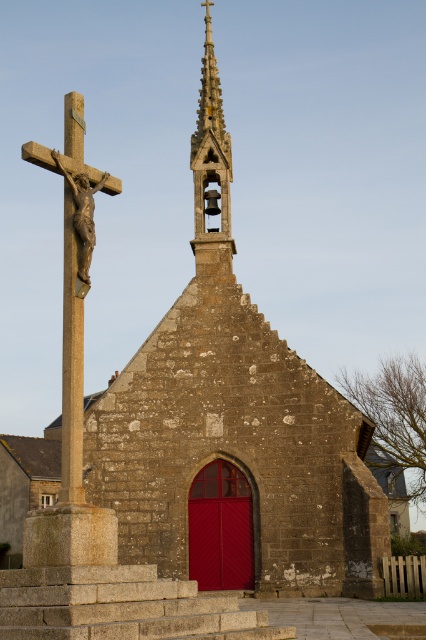
Based on the photo, who is more forward, [195,138] or [92,220]?

Positioned in front is point [92,220].

Is point (222, 136) less distant than point (86, 218)?

No.

Who is more distant from viewer, (221, 260) or (80, 204)?

Positioned behind is point (221, 260).

Where is `smooth stone spire at upper center`? smooth stone spire at upper center is located at coordinates (210, 170).